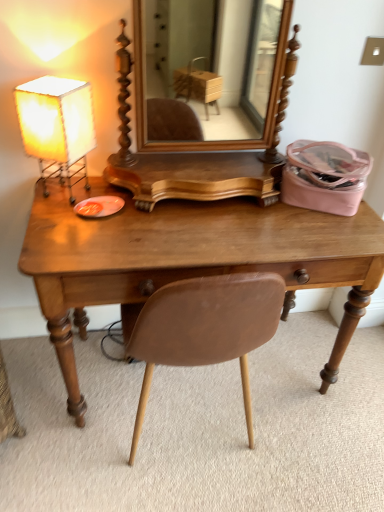
Locate an element on the screen. free space above wooden desk at center (from a real-world perspective) is located at coordinates (208, 219).